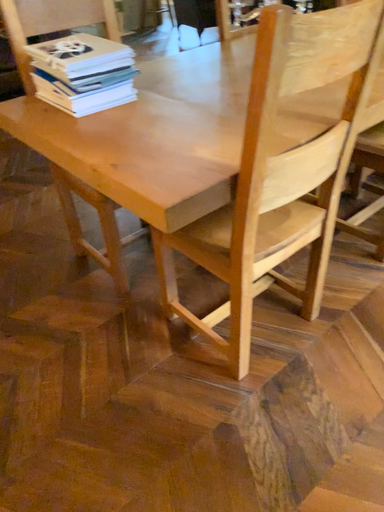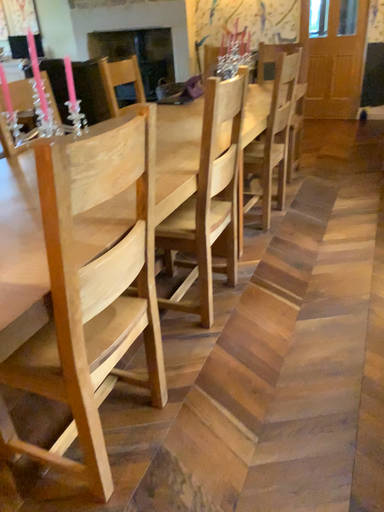
Question: How did the camera likely rotate when shooting the video?

Choices:
 (A) rotated right
 (B) rotated left

Answer: (A)